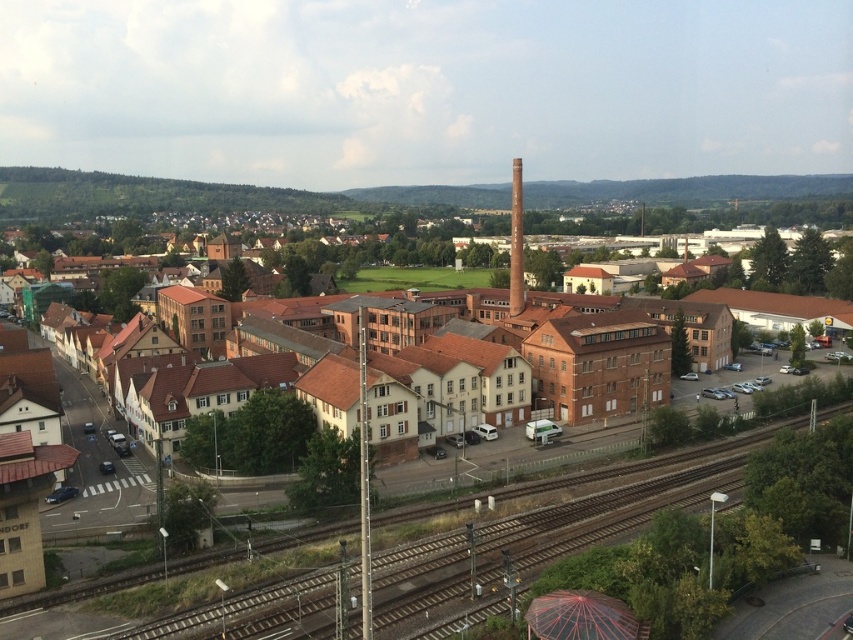
In order to click on brown brick building at center in this screenshot , I will do `click(97, 294)`.

In the scene shown: Can you confirm if brown brick building at center is shorter than brown wooden train track at lower center?

Incorrect, brown brick building at center's height does not fall short of brown wooden train track at lower center's.

In the scene shown: Who is more forward, [260,221] or [593,481]?

Point [593,481] is in front.

The image size is (853, 640). Identify the location of brown brick building at center. (97, 294).